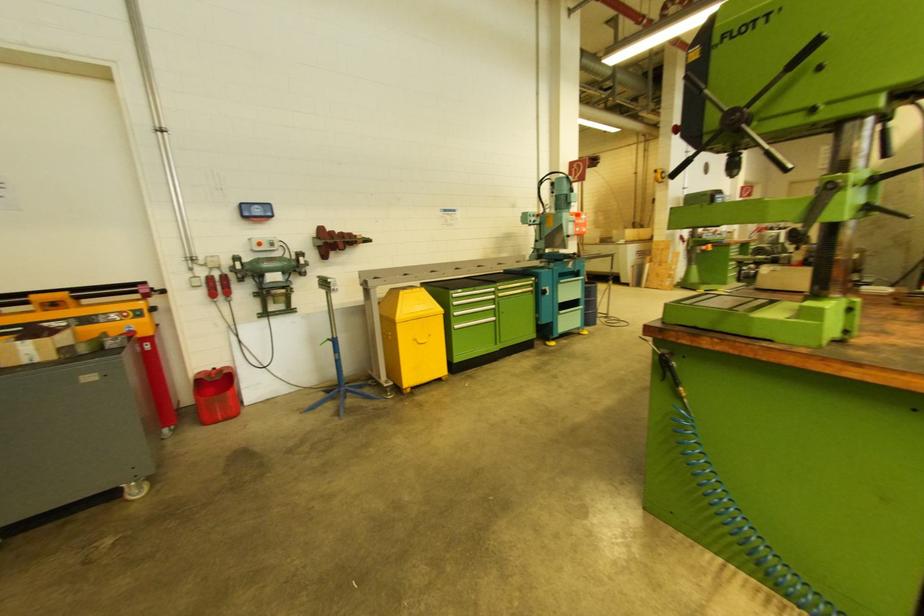
Where is `black adjustment lever`? This screenshot has width=924, height=616. black adjustment lever is located at coordinates (748, 111).